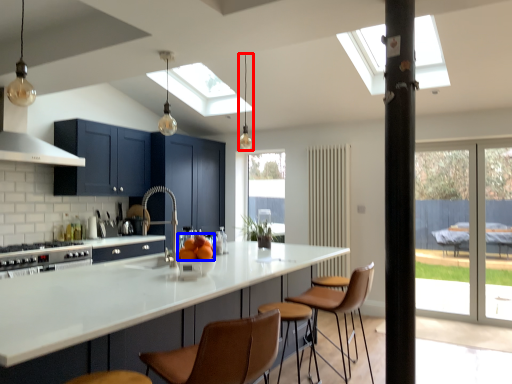
Question: Among these objects, which one is farthest to the camera, light fixture (highlighted by a red box) or orange (highlighted by a blue box)?

Choices:
 (A) light fixture
 (B) orange

Answer: (A)